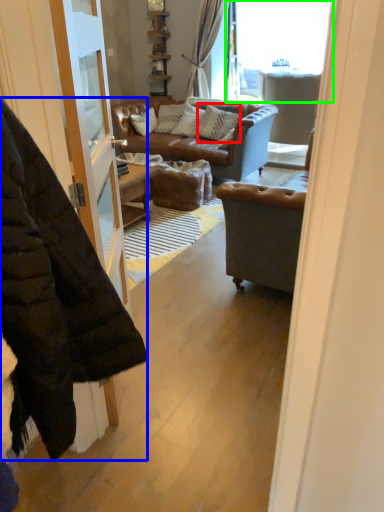
Question: Based on their relative distances, which object is farther from pillow (highlighted by a red box)? Choose from jacket (highlighted by a blue box) and window (highlighted by a green box).

Choices:
 (A) jacket
 (B) window

Answer: (A)